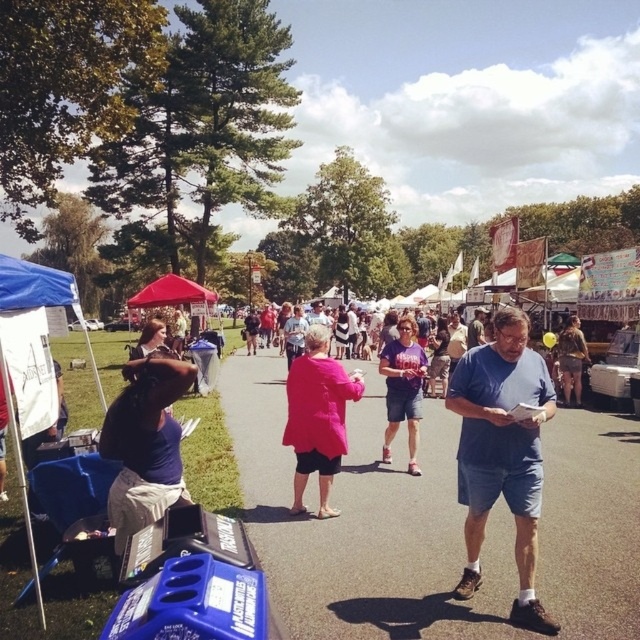
Is blue fabric at center smaller than camouflage-patterned shorts at right?

Incorrect, blue fabric at center is not smaller in size than camouflage-patterned shorts at right.

Is blue fabric at center shorter than camouflage-patterned shorts at right?

Indeed, blue fabric at center has a lesser height compared to camouflage-patterned shorts at right.

The height and width of the screenshot is (640, 640). I want to click on blue fabric at center, so click(x=364, y=522).

Who is more distant from viewer, (371, 538) or (452, 404)?

Positioned behind is point (371, 538).

Does blue fabric at center have a greater width compared to blue cotton shirt at center?

Indeed, blue fabric at center has a greater width compared to blue cotton shirt at center.

Which is in front, point (602, 465) or point (477, 442)?

Point (477, 442)

Where is `blue fabric at center`? blue fabric at center is located at coordinates click(364, 522).

Is purple cotton shirt at center in front of pink fabric at center?

Yes, purple cotton shirt at center is in front of pink fabric at center.

Can you confirm if purple cotton shirt at center is smaller than pink fabric at center?

Indeed, purple cotton shirt at center has a smaller size compared to pink fabric at center.

Between point (401, 384) and point (364, 355), which one is positioned in front?

Positioned in front is point (401, 384).

The height and width of the screenshot is (640, 640). In order to click on purple cotton shirt at center in this screenshot , I will do (403, 388).